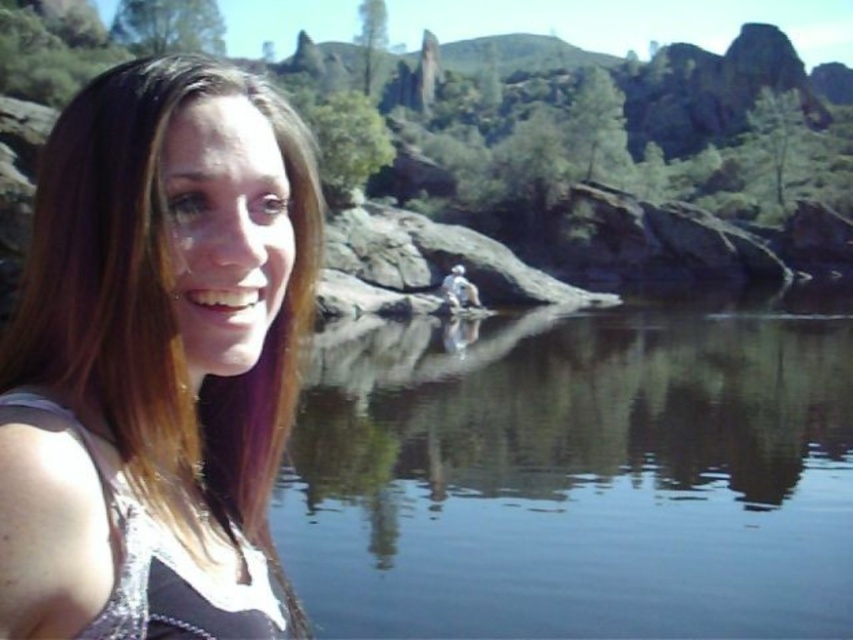
Question: Which is farther from the white matte person at center?

Choices:
 (A) clear water at center
 (B) shiny silver tank top at left

Answer: (B)

Question: From the image, what is the correct spatial relationship of clear water at center in relation to shiny silver tank top at left?

Choices:
 (A) above
 (B) below

Answer: (B)

Question: Which point is farther from the camera taking this photo?

Choices:
 (A) (71, 474)
 (B) (634, 392)
 (C) (457, 296)

Answer: (C)

Question: Which of the following is the farthest from the observer?

Choices:
 (A) (192, 604)
 (B) (457, 275)

Answer: (B)

Question: Is shiny silver tank top at left thinner than white matte person at center?

Choices:
 (A) no
 (B) yes

Answer: (A)

Question: Is shiny silver tank top at left wider than white matte person at center?

Choices:
 (A) yes
 (B) no

Answer: (A)